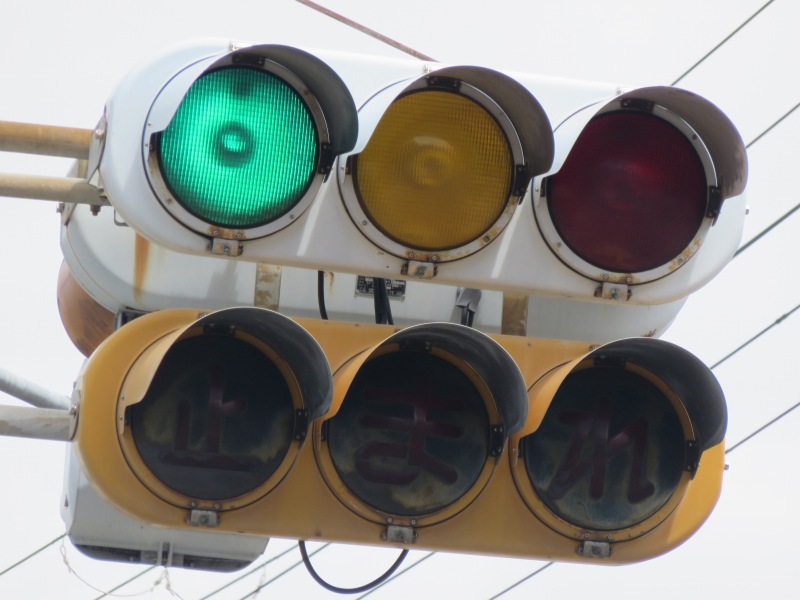
Locate an element on the screen. This screenshot has width=800, height=600. green light is located at coordinates (230, 140).